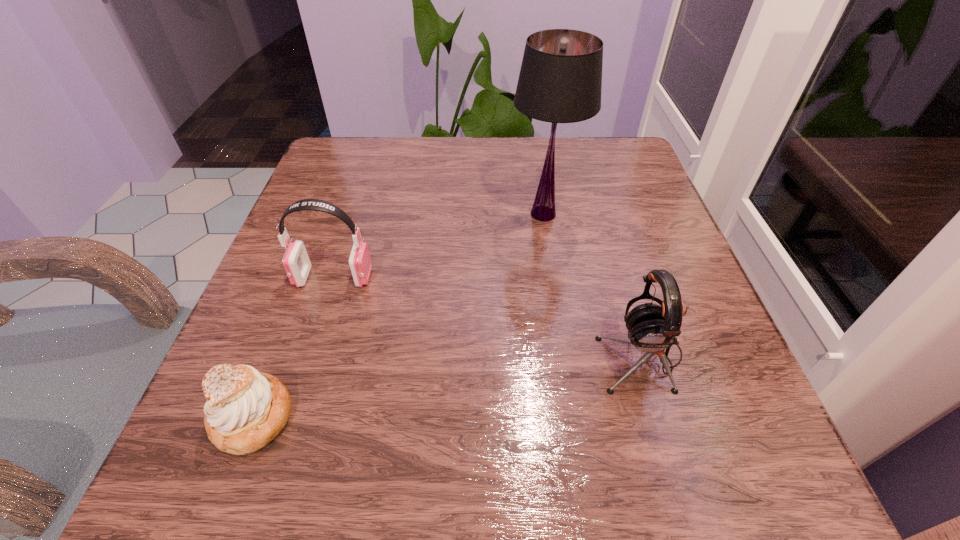
The height and width of the screenshot is (540, 960). I want to click on empty location between the shortest object and the right earphone, so (446, 387).

Identify the location of vacant area that lies between the right earphone and the shortest object. (446, 387).

Find the location of `empty location between the right earphone and the farther earphone`. empty location between the right earphone and the farther earphone is located at coordinates (488, 316).

At what (x,y) coordinates should I click in order to perform the action: click on blank region between the lampshade and the shortest object. Please return your answer as a coordinate pair (x, y). The image size is (960, 540). Looking at the image, I should click on (397, 315).

At what (x,y) coordinates should I click in order to perform the action: click on empty space that is in between the shortest object and the left earphone. Please return your answer as a coordinate pair (x, y). This screenshot has width=960, height=540. Looking at the image, I should click on (293, 347).

This screenshot has height=540, width=960. In order to click on object that stands as the third closest to the right earphone in this screenshot , I will do `click(245, 410)`.

Locate an element on the screen. object that is the third closest to the shortest object is located at coordinates (560, 81).

This screenshot has width=960, height=540. In order to click on free space in the image that satisfies the following two spatial constraints: 1. on the outer surface of the second farthest object; 2. on the back side of the nearer earphone in this screenshot , I will do `click(309, 356)`.

This screenshot has height=540, width=960. What are the coordinates of `vacant space that satisfies the following two spatial constraints: 1. on the front-facing side of the lampshade; 2. on the right side of the nearer earphone` in the screenshot? It's located at (565, 356).

The width and height of the screenshot is (960, 540). What are the coordinates of `vacant region that satisfies the following two spatial constraints: 1. on the outer surface of the left earphone; 2. on the front side of the pastry` in the screenshot? It's located at (289, 417).